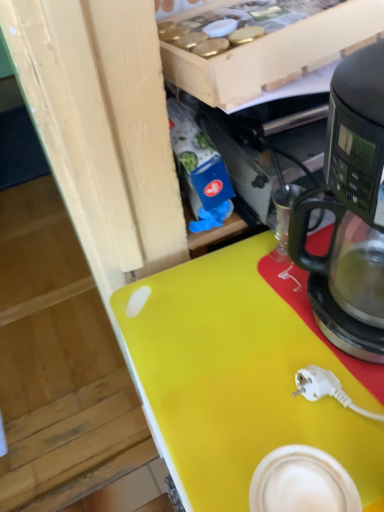
Question: From a real-world perspective, does black matte coffee maker at right sit lower than yellow matte desk at center?

Choices:
 (A) no
 (B) yes

Answer: (A)

Question: From the image's perspective, would you say black matte coffee maker at right is shown under yellow matte desk at center?

Choices:
 (A) no
 (B) yes

Answer: (A)

Question: Can you see black matte coffee maker at right touching yellow matte desk at center?

Choices:
 (A) no
 (B) yes

Answer: (A)

Question: Can we say black matte coffee maker at right lies outside yellow matte desk at center?

Choices:
 (A) yes
 (B) no

Answer: (A)

Question: Does black matte coffee maker at right contain yellow matte desk at center?

Choices:
 (A) yes
 (B) no

Answer: (B)

Question: Is black matte coffee maker at right facing towards yellow matte desk at center?

Choices:
 (A) yes
 (B) no

Answer: (B)

Question: Is yellow matte desk at center shorter than black matte coffee maker at right?

Choices:
 (A) yes
 (B) no

Answer: (B)

Question: Considering the relative positions of yellow matte desk at center and black matte coffee maker at right in the image provided, is yellow matte desk at center in front of black matte coffee maker at right?

Choices:
 (A) no
 (B) yes

Answer: (A)

Question: Can you confirm if yellow matte desk at center is positioned to the right of black matte coffee maker at right?

Choices:
 (A) yes
 (B) no

Answer: (B)

Question: Considering the relative sizes of yellow matte desk at center and black matte coffee maker at right in the image provided, is yellow matte desk at center thinner than black matte coffee maker at right?

Choices:
 (A) yes
 (B) no

Answer: (B)

Question: From a real-world perspective, does yellow matte desk at center sit lower than black matte coffee maker at right?

Choices:
 (A) no
 (B) yes

Answer: (B)

Question: Does yellow matte desk at center have a smaller size compared to black matte coffee maker at right?

Choices:
 (A) no
 (B) yes

Answer: (A)

Question: In the image, is yellow matte desk at center on the left side or the right side of black matte coffee maker at right?

Choices:
 (A) right
 (B) left

Answer: (B)